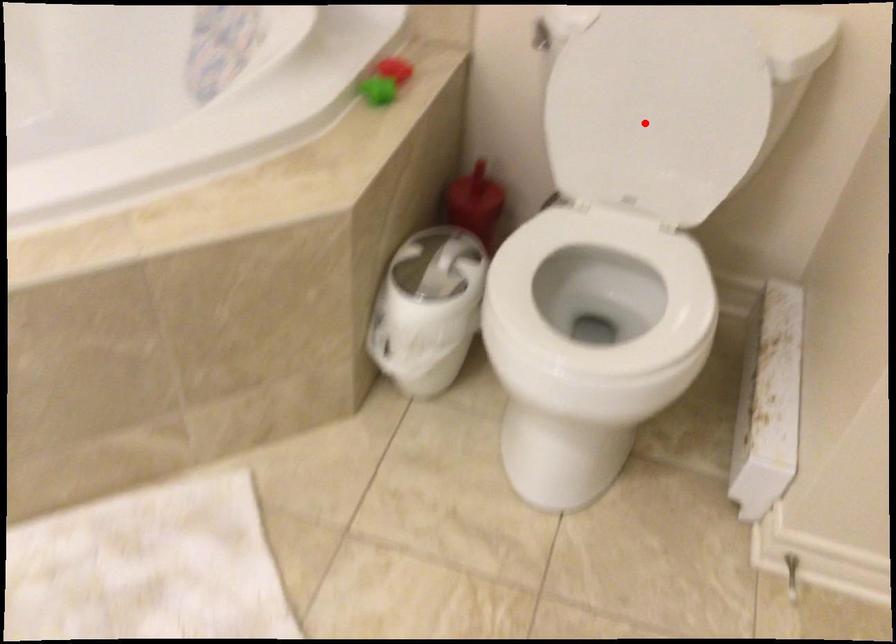
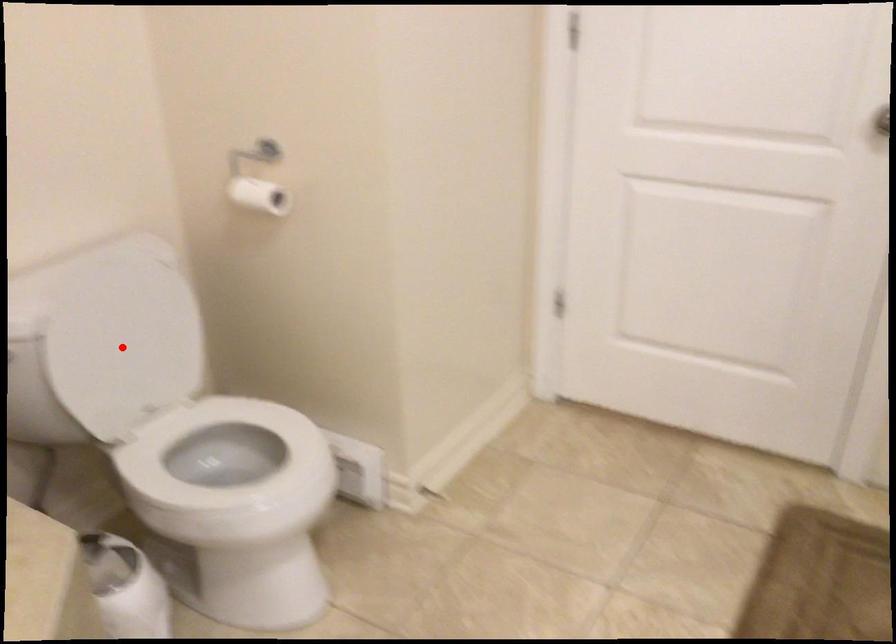
I am providing you with two images of the same scene from different viewpoints. A red point is marked on the first image and another point is marked on the second image. Is the marked point in image1 the same physical position as the marked point in image2?

Yes